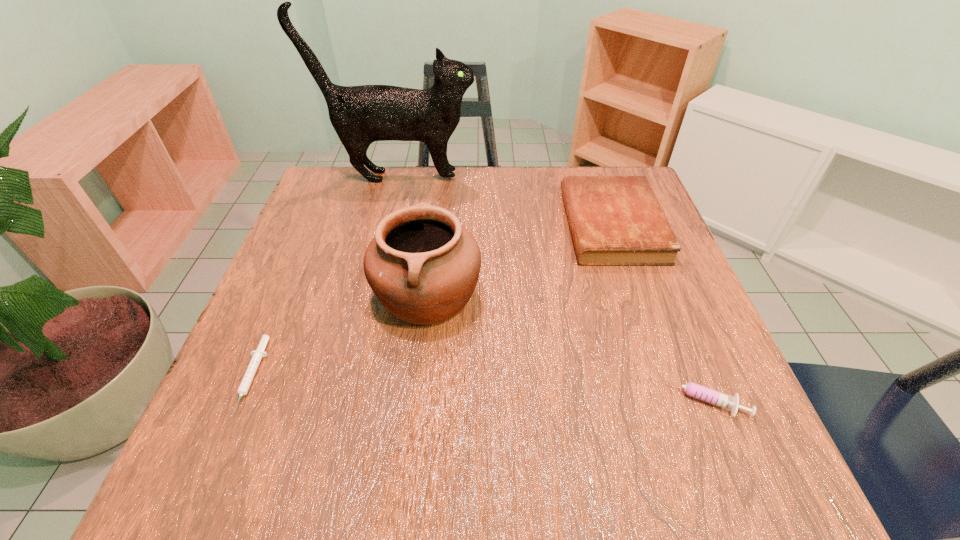
The height and width of the screenshot is (540, 960). I want to click on cat, so click(x=360, y=115).

At what (x,y) coordinates should I click in order to perform the action: click on the farthest object. Please return your answer as a coordinate pair (x, y). The width and height of the screenshot is (960, 540). Looking at the image, I should click on click(x=360, y=115).

The width and height of the screenshot is (960, 540). In order to click on the fourth shortest object in this screenshot , I will do `click(423, 266)`.

Where is `the third tallest object`? the third tallest object is located at coordinates (614, 220).

At what (x,y) coordinates should I click in order to perform the action: click on the second shortest object. Please return your answer as a coordinate pair (x, y). The height and width of the screenshot is (540, 960). Looking at the image, I should click on (694, 390).

Locate an element on the screen. Image resolution: width=960 pixels, height=540 pixels. the right syringe is located at coordinates (694, 390).

Identify the location of the shorter syringe. This screenshot has height=540, width=960. (257, 355).

You are a GUI agent. You are given a task and a screenshot of the screen. Output one action in this format:
    pyautogui.click(x=<x>, y=<y>)
    Task: Click on the left syringe
    
    Given the screenshot: What is the action you would take?
    pyautogui.click(x=257, y=355)

This screenshot has height=540, width=960. What are the coordinates of `vacant space situated 0.100m on the face of the farthest object` in the screenshot? It's located at (513, 177).

I want to click on vacant space located 0.260m on the front of the fourth shortest object, so click(x=405, y=484).